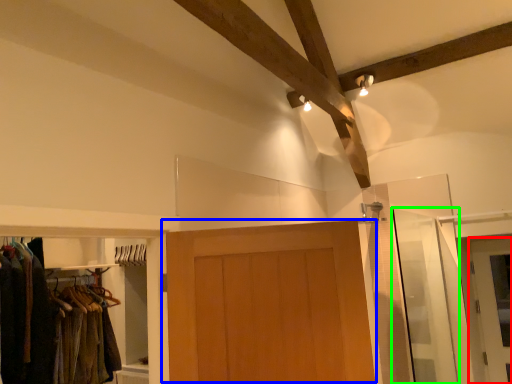
Question: Which is farther away from door (highlighted by a red box)? door (highlighted by a blue box) or screen door (highlighted by a green box)?

Choices:
 (A) door
 (B) screen door

Answer: (A)